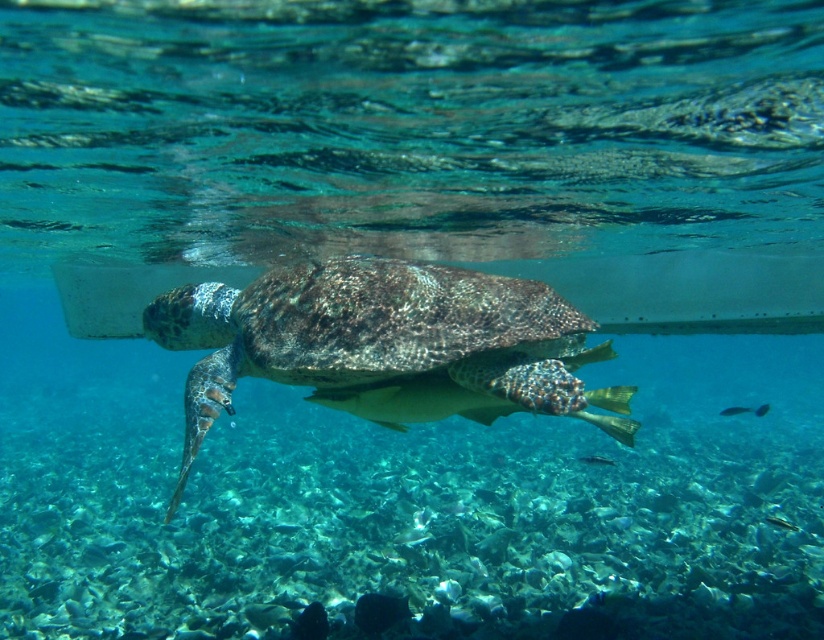
You are a marine biologist observing the underwater scene. You notice the textured brown tortoise at center and the shiny silver fish at center. Which of these two has a smaller height?

The textured brown tortoise at center has a lesser height compared to the shiny silver fish at center, so the textured brown tortoise at center is smaller in height.

You are a marine biologist observing the underwater scene. You notice the shiny blue fish at lower right and the shiny silver fish at center. Which fish would cast a larger shadow on the seabed below them?

The shiny blue fish at lower right is larger in size than the shiny silver fish at center, so it would cast a larger shadow on the seabed below them.